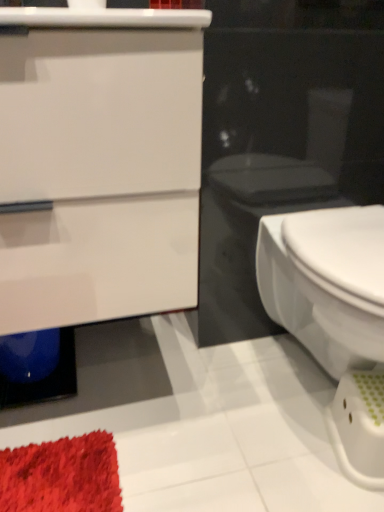
Question: Does white glossy bidet at right have a greater width compared to white glossy cabinet at upper left?

Choices:
 (A) yes
 (B) no

Answer: (A)

Question: Is white glossy cabinet at upper left surrounded by white glossy bidet at right?

Choices:
 (A) yes
 (B) no

Answer: (B)

Question: From a real-world perspective, is white glossy bidet at right over white glossy cabinet at upper left?

Choices:
 (A) no
 (B) yes

Answer: (A)

Question: Does white glossy bidet at right appear on the left side of white glossy cabinet at upper left?

Choices:
 (A) no
 (B) yes

Answer: (A)

Question: Considering the relative sizes of white glossy bidet at right and white glossy cabinet at upper left in the image provided, is white glossy bidet at right bigger than white glossy cabinet at upper left?

Choices:
 (A) yes
 (B) no

Answer: (B)

Question: Does white glossy bidet at right have a lesser width compared to white glossy cabinet at upper left?

Choices:
 (A) no
 (B) yes

Answer: (A)

Question: Does white glossy cabinet at upper left have a greater height compared to white glossy bidet at right?

Choices:
 (A) yes
 (B) no

Answer: (A)

Question: Is white glossy cabinet at upper left at the left side of white glossy bidet at right?

Choices:
 (A) no
 (B) yes

Answer: (B)

Question: Is white glossy cabinet at upper left looking in the opposite direction of white glossy bidet at right?

Choices:
 (A) yes
 (B) no

Answer: (B)

Question: Considering the relative positions of white glossy cabinet at upper left and white glossy bidet at right in the image provided, is white glossy cabinet at upper left to the right of white glossy bidet at right from the viewer's perspective?

Choices:
 (A) yes
 (B) no

Answer: (B)

Question: From the image's perspective, would you say white glossy cabinet at upper left is shown under white glossy bidet at right?

Choices:
 (A) yes
 (B) no

Answer: (B)

Question: Would you say white glossy bidet at right is part of white glossy cabinet at upper left's contents?

Choices:
 (A) yes
 (B) no

Answer: (B)

Question: Visually, is white glossy cabinet at upper left positioned to the left or to the right of white glossy bidet at right?

Choices:
 (A) left
 (B) right

Answer: (A)